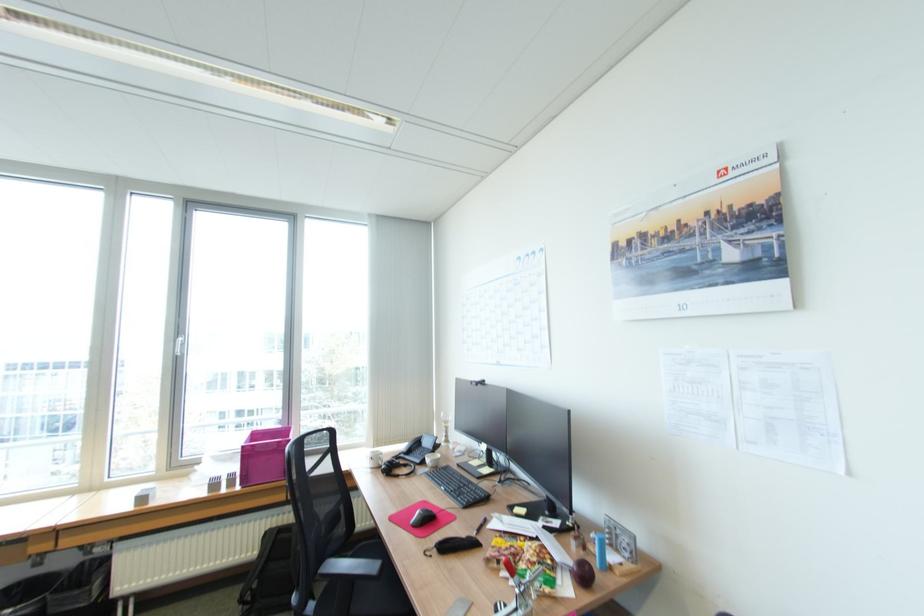
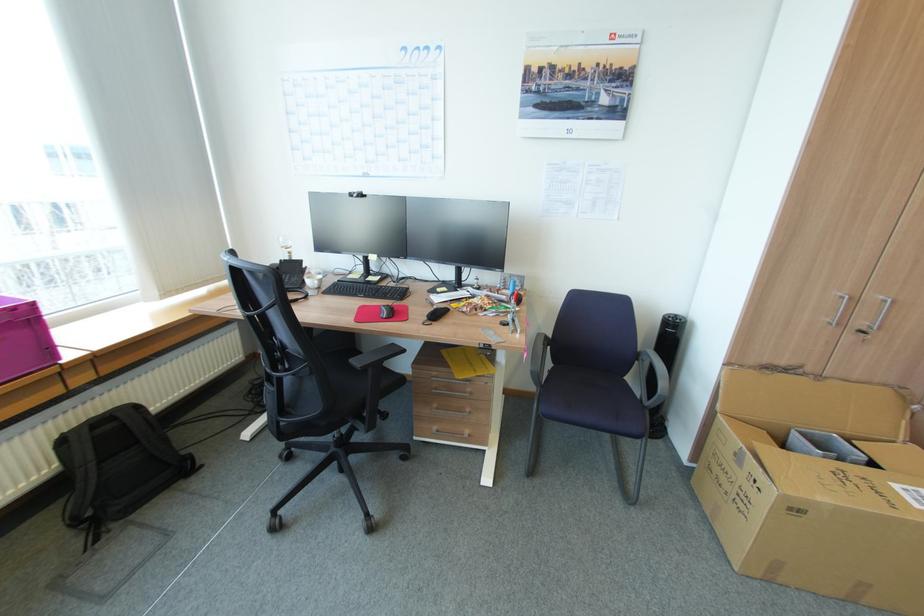
In the second image, find the point that corresponds to (272,533) in the first image.

(68, 440)